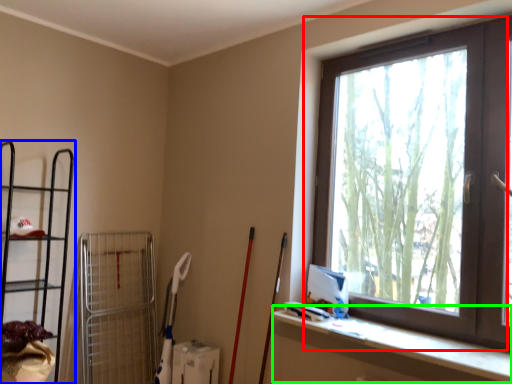
Question: Considering the real-world distances, which object is farthest from window (highlighted by a red box)? shelf (highlighted by a blue box) or ledge (highlighted by a green box)?

Choices:
 (A) shelf
 (B) ledge

Answer: (A)